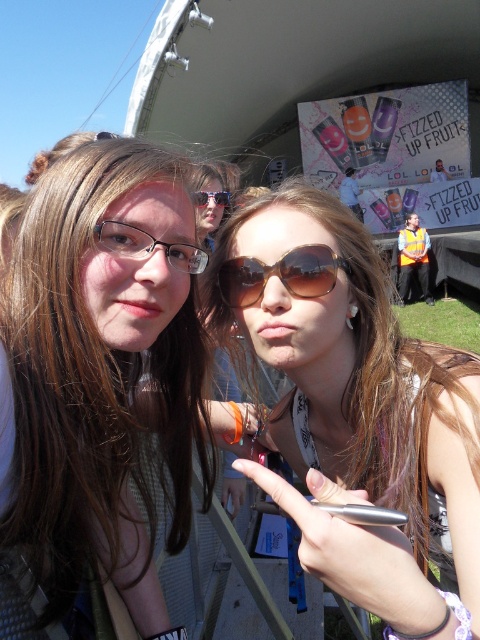
Question: Which object appears closest to the camera in this image?

Choices:
 (A) shiny black sunglasses at center
 (B) yellow reflective vest at center
 (C) sunglasses at center
 (D) brown matte sunglasses at center

Answer: (D)

Question: Which object is positioned closest to the matte black glasses at left?

Choices:
 (A) sunglasses at center
 (B) yellow reflective vest at center

Answer: (A)

Question: Does sunglasses at center have a larger size compared to yellow reflective vest at center?

Choices:
 (A) yes
 (B) no

Answer: (B)

Question: Which point appears farthest from the camera in this image?

Choices:
 (A) (429, 248)
 (B) (227, 202)
 (C) (182, 264)
 (D) (252, 294)

Answer: (A)

Question: Can you confirm if sunglasses at center is bigger than matte black glasses at center?

Choices:
 (A) no
 (B) yes

Answer: (B)

Question: Does sunglasses at center appear over shiny black sunglasses at center?

Choices:
 (A) yes
 (B) no

Answer: (B)